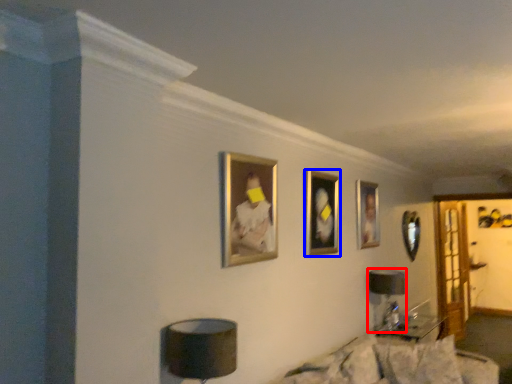
Question: Which object appears farthest to the camera in this image, table lamp (highlighted by a red box) or picture frame (highlighted by a blue box)?

Choices:
 (A) table lamp
 (B) picture frame

Answer: (A)